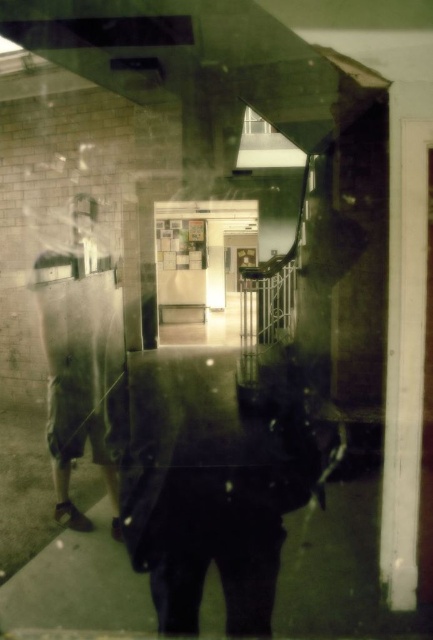
Is dark fabric jacket at center below matte khaki shorts at left?

Yes.

Is the position of dark fabric jacket at center less distant than that of matte khaki shorts at left?

Yes.

Is point (187, 632) closer to viewer compared to point (45, 348)?

Yes, it is.

Image resolution: width=433 pixels, height=640 pixels. What are the coordinates of `dark fabric jacket at center` in the screenshot? It's located at (213, 483).